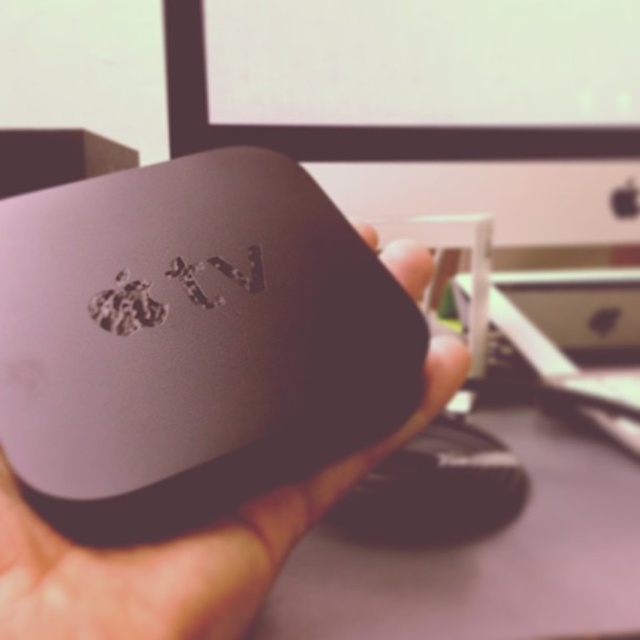
Question: Does matte gray apple tv at center have a larger size compared to black matte mouse at center?

Choices:
 (A) no
 (B) yes

Answer: (B)

Question: Which object appears closest to the camera in this image?

Choices:
 (A) matte gray apple tv at center
 (B) black matte mouse at center

Answer: (A)

Question: Does matte gray apple tv at center have a lesser width compared to black matte mouse at center?

Choices:
 (A) yes
 (B) no

Answer: (B)

Question: Which of the following is the farthest from the observer?

Choices:
 (A) (333, 518)
 (B) (24, 634)

Answer: (A)

Question: Can you confirm if matte gray apple tv at center is positioned below black matte mouse at center?

Choices:
 (A) yes
 (B) no

Answer: (B)